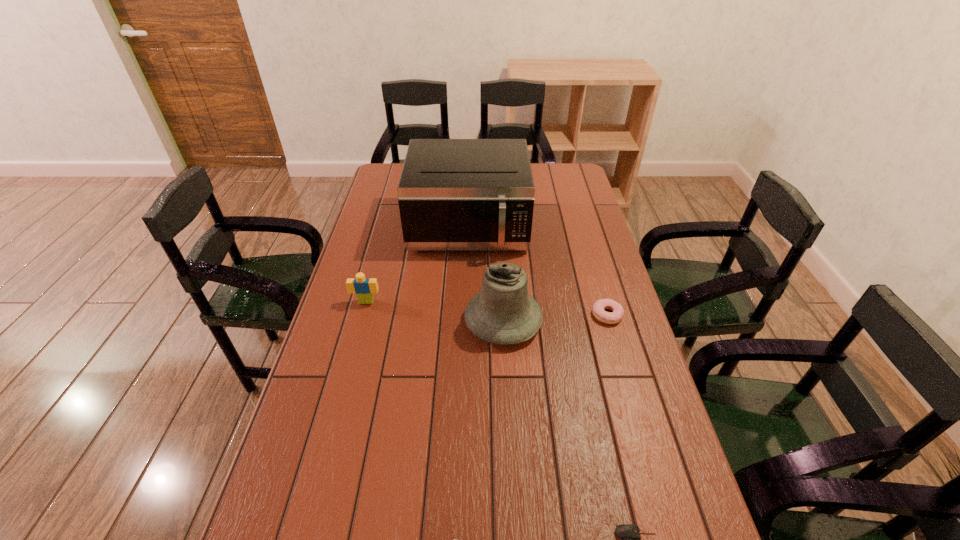
Identify the location of object located in the left edge section of the desktop. This screenshot has width=960, height=540. (364, 288).

The height and width of the screenshot is (540, 960). I want to click on object that is at the right edge, so click(600, 314).

In the image, there is a desktop. Where is `free space at the left edge`? This screenshot has height=540, width=960. free space at the left edge is located at coordinates (347, 393).

Locate an element on the screen. free location at the right edge is located at coordinates (566, 202).

Locate an element on the screen. The height and width of the screenshot is (540, 960). free space at the far left corner of the desktop is located at coordinates (396, 186).

Where is `free location at the far right corner`? The image size is (960, 540). free location at the far right corner is located at coordinates (568, 178).

Locate an element on the screen. vacant area that lies between the tallest object and the fifth tallest object is located at coordinates (538, 272).

This screenshot has width=960, height=540. In order to click on unoccupied position between the microwave_oven and the doughnut in this screenshot , I will do `click(538, 272)`.

This screenshot has height=540, width=960. In order to click on vacant area that lies between the fifth shortest object and the doughnut in this screenshot , I will do tap(555, 318).

Select which object appears as the second closest to the fourth tallest object. Please provide its 2D coordinates. Your answer should be formatted as a tuple, i.e. [(x, y)], where the tuple contains the x and y coordinates of a point satisfying the conditions above.

[(503, 313)]